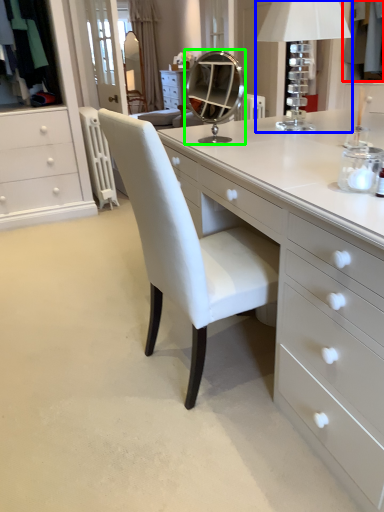
Question: Based on their relative distances, which object is farther from clothing (highlighted by a red box)? Choose from table lamp (highlighted by a blue box) and mirror (highlighted by a green box).

Choices:
 (A) table lamp
 (B) mirror

Answer: (B)